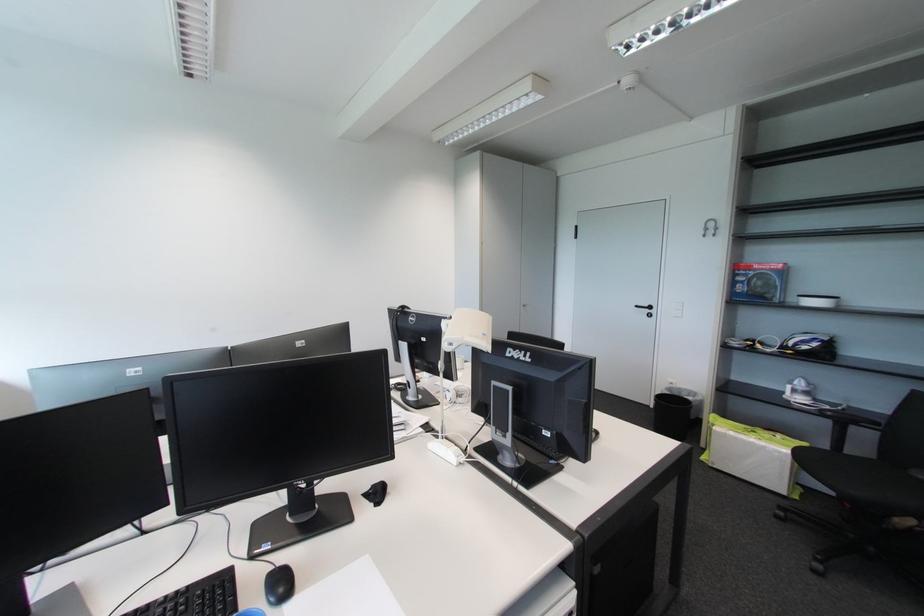
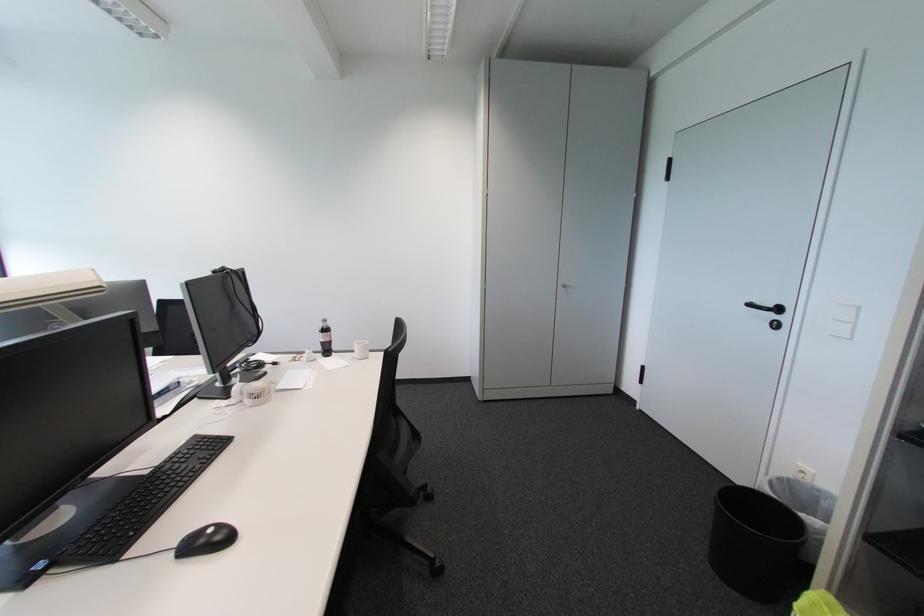
Locate, in the second image, the point that corresponds to point 529,309 in the first image.

(567, 290)